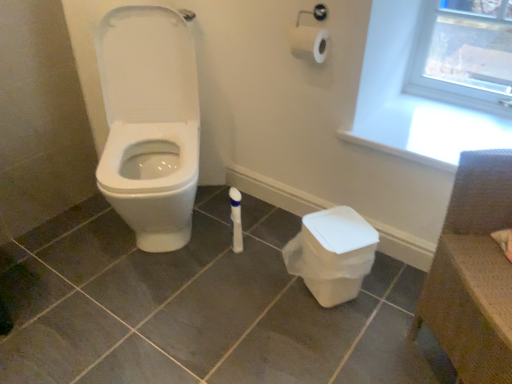
Question: Considering the relative sizes of white plastic window frame at upper right and brown woven chair at upper right in the image provided, is white plastic window frame at upper right thinner than brown woven chair at upper right?

Choices:
 (A) no
 (B) yes

Answer: (B)

Question: Can you confirm if white plastic window frame at upper right is bigger than brown woven chair at upper right?

Choices:
 (A) yes
 (B) no

Answer: (B)

Question: From a real-world perspective, is white plastic window frame at upper right on top of brown woven chair at upper right?

Choices:
 (A) no
 (B) yes

Answer: (B)

Question: Is white plastic window frame at upper right further to camera compared to brown woven chair at upper right?

Choices:
 (A) no
 (B) yes

Answer: (B)

Question: Is white plastic window frame at upper right facing towards brown woven chair at upper right?

Choices:
 (A) no
 (B) yes

Answer: (B)

Question: Is brown woven chair at upper right wider or thinner than white plastic window frame at upper right?

Choices:
 (A) thin
 (B) wide

Answer: (B)

Question: Choose the correct answer: Is brown woven chair at upper right inside white plastic window frame at upper right or outside it?

Choices:
 (A) inside
 (B) outside

Answer: (B)

Question: From a real-world perspective, is brown woven chair at upper right above or below white plastic window frame at upper right?

Choices:
 (A) below
 (B) above

Answer: (A)

Question: From the image's perspective, relative to white plastic window frame at upper right, is brown woven chair at upper right above or below?

Choices:
 (A) below
 (B) above

Answer: (A)

Question: Is white plastic potty at lower right taller or shorter than white plastic window frame at upper right?

Choices:
 (A) tall
 (B) short

Answer: (B)

Question: Does point (313, 291) appear closer or farther from the camera than point (467, 99)?

Choices:
 (A) farther
 (B) closer

Answer: (B)

Question: Considering their positions, is white plastic potty at lower right located in front of or behind white plastic window frame at upper right?

Choices:
 (A) front
 (B) behind

Answer: (A)

Question: Is white plastic potty at lower right situated inside white plastic window frame at upper right or outside?

Choices:
 (A) inside
 (B) outside

Answer: (B)

Question: Do you think white plastic potty at lower right is within brown woven chair at upper right, or outside of it?

Choices:
 (A) inside
 (B) outside

Answer: (B)

Question: From the image's perspective, is white plastic potty at lower right positioned above or below brown woven chair at upper right?

Choices:
 (A) above
 (B) below

Answer: (B)